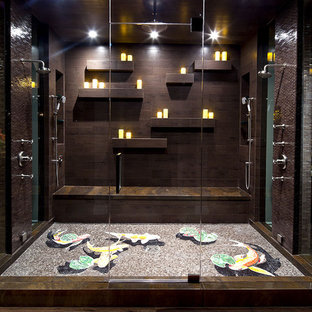
Locate an element on the screen. This screenshot has width=312, height=312. door handle is located at coordinates (116, 164).